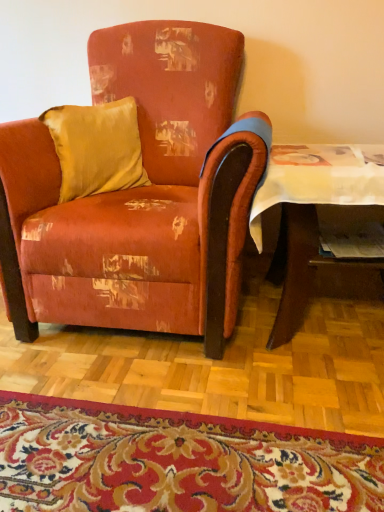
Question: Does matte paper magazine at lower right have a lesser width compared to carpet with floral pattern at lower center?

Choices:
 (A) no
 (B) yes

Answer: (B)

Question: From a real-world perspective, is matte paper magazine at lower right located beneath carpet with floral pattern at lower center?

Choices:
 (A) no
 (B) yes

Answer: (A)

Question: From a real-world perspective, is matte paper magazine at lower right over carpet with floral pattern at lower center?

Choices:
 (A) no
 (B) yes

Answer: (B)

Question: From the image's perspective, does matte paper magazine at lower right appear lower than carpet with floral pattern at lower center?

Choices:
 (A) no
 (B) yes

Answer: (A)

Question: Is matte paper magazine at lower right aimed at carpet with floral pattern at lower center?

Choices:
 (A) yes
 (B) no

Answer: (B)

Question: Is matte paper magazine at lower right at the left side of carpet with floral pattern at lower center?

Choices:
 (A) no
 (B) yes

Answer: (A)

Question: Does matte paper magazine at lower right have a lesser height compared to satin gold pillow at upper left?

Choices:
 (A) no
 (B) yes

Answer: (B)

Question: Can satin gold pillow at upper left be found inside matte paper magazine at lower right?

Choices:
 (A) no
 (B) yes

Answer: (A)

Question: Considering the relative sizes of matte paper magazine at lower right and satin gold pillow at upper left in the image provided, is matte paper magazine at lower right bigger than satin gold pillow at upper left?

Choices:
 (A) yes
 (B) no

Answer: (B)

Question: From the image's perspective, does matte paper magazine at lower right appear lower than satin gold pillow at upper left?

Choices:
 (A) no
 (B) yes

Answer: (B)

Question: Does matte paper magazine at lower right have a lesser width compared to satin gold pillow at upper left?

Choices:
 (A) yes
 (B) no

Answer: (B)

Question: Would you say matte paper magazine at lower right is outside satin gold pillow at upper left?

Choices:
 (A) yes
 (B) no

Answer: (A)

Question: Can you confirm if wooden table at lower right is wider than carpet with floral pattern at lower center?

Choices:
 (A) no
 (B) yes

Answer: (A)